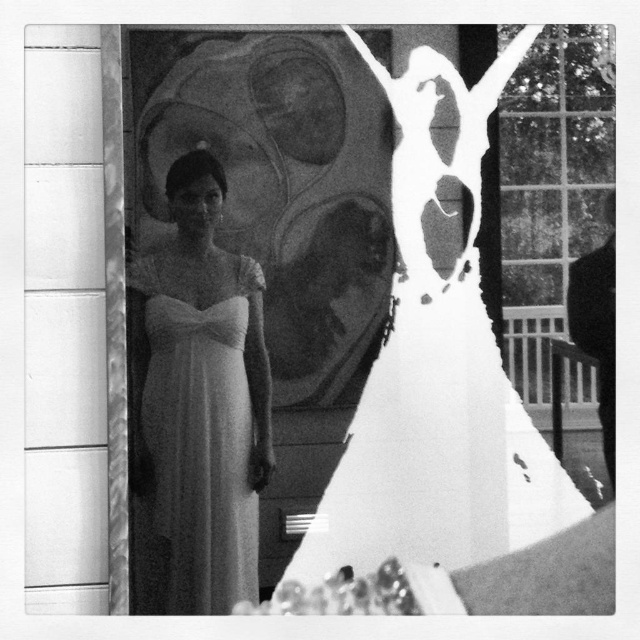
Is point (188, 582) behind point (356, 280)?

No, (188, 582) is in front of (356, 280).

Can you confirm if satin white dress at center is bigger than matte white dress at center?

Indeed, satin white dress at center has a larger size compared to matte white dress at center.

Find the location of a particular element. The image size is (640, 640). satin white dress at center is located at coordinates (202, 396).

Where is `satin white dress at center`? satin white dress at center is located at coordinates (202, 396).

Which is below, satin white dress at center or black matte suit at right?

Positioned lower is satin white dress at center.

Is point (180, 579) farther from viewer compared to point (593, 301)?

No, it is not.

Which is behind, point (186, 189) or point (605, 444)?

Positioned behind is point (605, 444).

At what (x,y) coordinates should I click in order to perform the action: click on satin white dress at center. Please return your answer as a coordinate pair (x, y). This screenshot has width=640, height=640. Looking at the image, I should click on (202, 396).

Can you confirm if matte white dress at center is positioned to the left of black matte suit at right?

Yes, matte white dress at center is to the left of black matte suit at right.

Can you confirm if matte white dress at center is wider than black matte suit at right?

Yes, matte white dress at center is wider than black matte suit at right.

Is point (284, 280) farther from viewer compared to point (602, 278)?

No.

This screenshot has width=640, height=640. What are the coordinates of `matte white dress at center` in the screenshot? It's located at [326, 298].